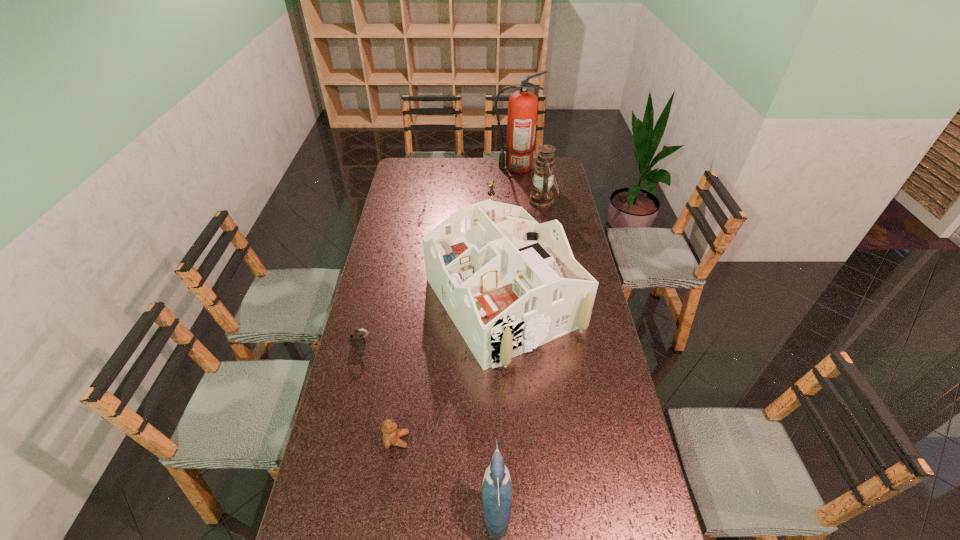
Identify the location of the tallest object. Image resolution: width=960 pixels, height=540 pixels. tap(522, 106).

The height and width of the screenshot is (540, 960). Identify the location of the farthest object. (522, 106).

You are a GUI agent. You are given a task and a screenshot of the screen. Output one action in this format:
    pyautogui.click(x=<x>, y=<y>)
    Task: Click on the dollhouse
    This screenshot has height=540, width=960.
    Given the screenshot: What is the action you would take?
    pyautogui.click(x=509, y=284)

Identify the location of lantern. The image size is (960, 540). [x=541, y=197].

At what (x,y) coordinates should I click in order to perform the action: click on telephone. Please return your answer as a coordinate pair (x, y). The width and height of the screenshot is (960, 540). Looking at the image, I should click on tap(491, 193).

This screenshot has width=960, height=540. Identify the location of the sixth farthest object. (391, 435).

You are a GUI agent. You are given a task and a screenshot of the screen. Output one action in this format:
    pyautogui.click(x=<x>, y=<y>)
    Task: Click on the teddy bear
    This screenshot has width=960, height=540.
    Given the screenshot: What is the action you would take?
    pyautogui.click(x=391, y=435)

I want to click on the leftmost object, so click(357, 340).

You are a GUI agent. You are given a task and a screenshot of the screen. Output one action in this format:
    pyautogui.click(x=<x>, y=<y>)
    Task: Click on the padlock
    Image resolution: width=960 pixels, height=540 pixels.
    Given the screenshot: What is the action you would take?
    pyautogui.click(x=357, y=340)

The height and width of the screenshot is (540, 960). Identify the location of vacant area situated on the nozzle of the tallest object. [444, 167].